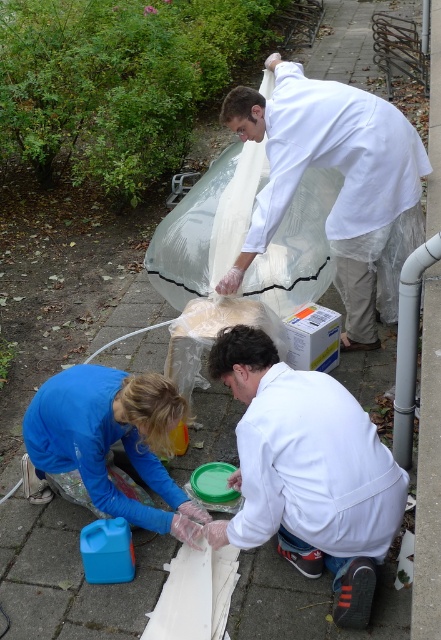
Which is below, white matte coat at upper center or blue fabric gloves at lower center?

blue fabric gloves at lower center

Is point (292, 164) positioned after point (49, 438)?

Yes, it is behind point (49, 438).

Where is `white matte coat at upper center`? The image size is (441, 640). white matte coat at upper center is located at coordinates (342, 186).

Does white matte lab coat at center appear on the right side of blue fabric gloves at lower center?

Correct, you'll find white matte lab coat at center to the right of blue fabric gloves at lower center.

What do you see at coordinates (307, 472) in the screenshot? I see `white matte lab coat at center` at bounding box center [307, 472].

This screenshot has width=441, height=640. Identify the location of white matte lab coat at center. (307, 472).

Does white matte lab coat at center have a larger size compared to white matte coat at upper center?

Incorrect, white matte lab coat at center is not larger than white matte coat at upper center.

I want to click on white matte lab coat at center, so click(307, 472).

Is point (370, 545) positioned after point (406, 150)?

No, it is not.

The image size is (441, 640). What are the coordinates of `white matte lab coat at center` in the screenshot? It's located at (307, 472).